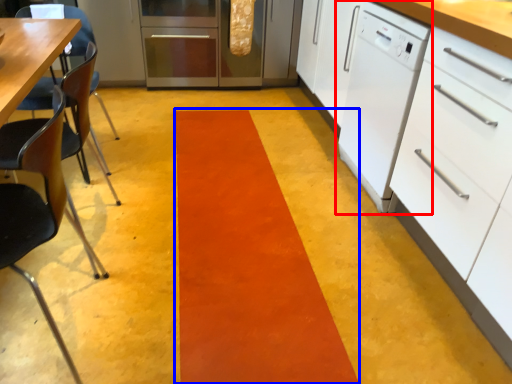
Question: Which object is further to the camera taking this photo, home appliance (highlighted by a red box) or strip (highlighted by a blue box)?

Choices:
 (A) home appliance
 (B) strip

Answer: (A)